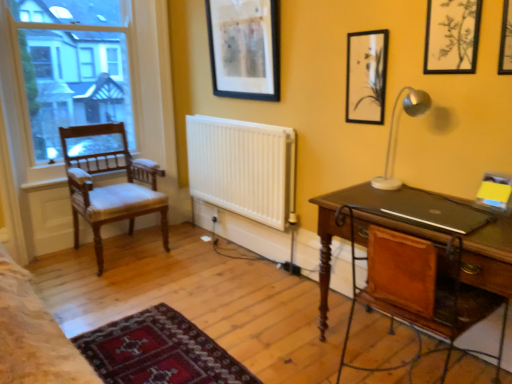
Question: From a real-world perspective, is clear glass window at left positioned under white matte radiator at center based on gravity?

Choices:
 (A) yes
 (B) no

Answer: (B)

Question: Is white matte radiator at center surrounded by clear glass window at left?

Choices:
 (A) no
 (B) yes

Answer: (A)

Question: Is clear glass window at left shorter than white matte radiator at center?

Choices:
 (A) no
 (B) yes

Answer: (A)

Question: Is white matte radiator at center at the back of clear glass window at left?

Choices:
 (A) no
 (B) yes

Answer: (A)

Question: Does clear glass window at left have a larger size compared to white matte radiator at center?

Choices:
 (A) yes
 (B) no

Answer: (A)

Question: In the image, is matte black picture frame at upper right, which is the 2th picture frame in back-to-front order, on the left side or the right side of clear glass window at left?

Choices:
 (A) left
 (B) right

Answer: (B)

Question: Is matte black picture frame at upper right, placed as the second picture frame when sorted from left to right, bigger or smaller than clear glass window at left?

Choices:
 (A) big
 (B) small

Answer: (B)

Question: From a real-world perspective, is matte black picture frame at upper right, marked as the third picture frame in a right-to-left arrangement, physically located above or below clear glass window at left?

Choices:
 (A) below
 (B) above

Answer: (B)

Question: Looking at their shapes, would you say matte black picture frame at upper right, which is the 2th picture frame in back-to-front order, is wider or thinner than clear glass window at left?

Choices:
 (A) wide
 (B) thin

Answer: (B)

Question: Considering their positions, is light brown wood chair at left located in front of or behind black matte laptop at right?

Choices:
 (A) front
 (B) behind

Answer: (B)

Question: In terms of width, does light brown wood chair at left look wider or thinner when compared to black matte laptop at right?

Choices:
 (A) wide
 (B) thin

Answer: (A)

Question: Is point (86, 185) closer or farther from the camera than point (433, 208)?

Choices:
 (A) farther
 (B) closer

Answer: (A)

Question: In terms of size, does light brown wood chair at left appear bigger or smaller than black matte laptop at right?

Choices:
 (A) small
 (B) big

Answer: (B)

Question: In the image, is black matte laptop at right on the left side or the right side of matte black picture frame at upper right, which is the 2th picture frame in back-to-front order?

Choices:
 (A) right
 (B) left

Answer: (A)

Question: In terms of width, does black matte laptop at right look wider or thinner when compared to matte black picture frame at upper right, which is the 2th picture frame in back-to-front order?

Choices:
 (A) thin
 (B) wide

Answer: (B)